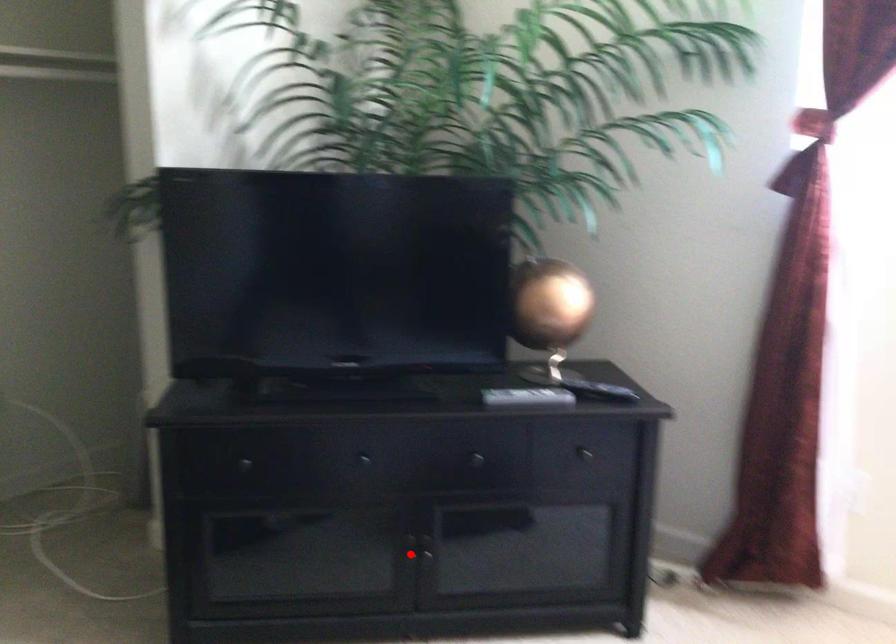
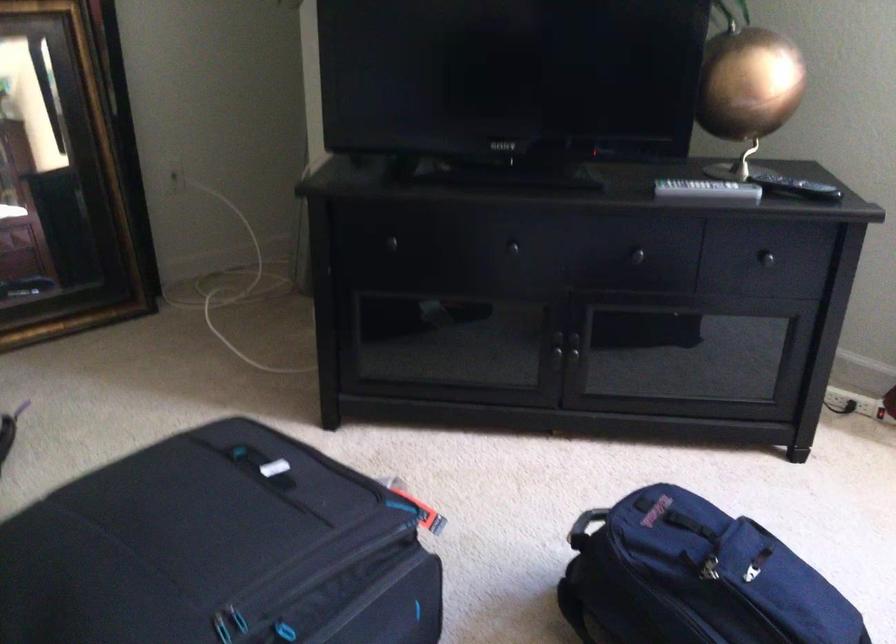
Locate, in the second image, the point that corresponds to the highlighted location in the first image.

(556, 353)